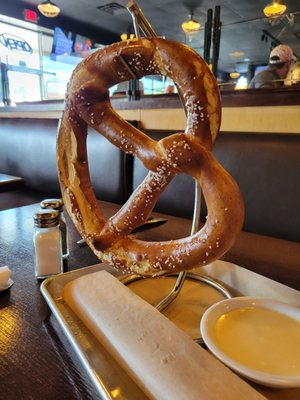
Find the location of `salt shaker`. salt shaker is located at coordinates (54, 262).